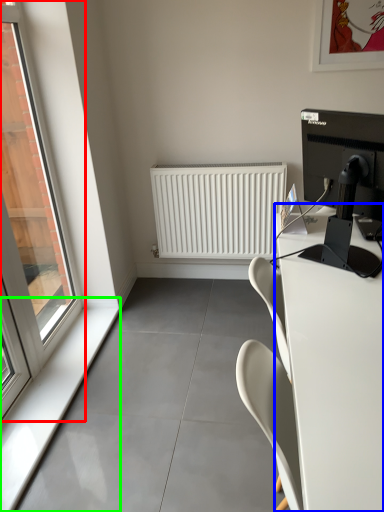
Question: Based on their relative distances, which object is farther from window (highlighted by a red box)? Choose from desk (highlighted by a blue box) and window sill (highlighted by a green box).

Choices:
 (A) desk
 (B) window sill

Answer: (A)